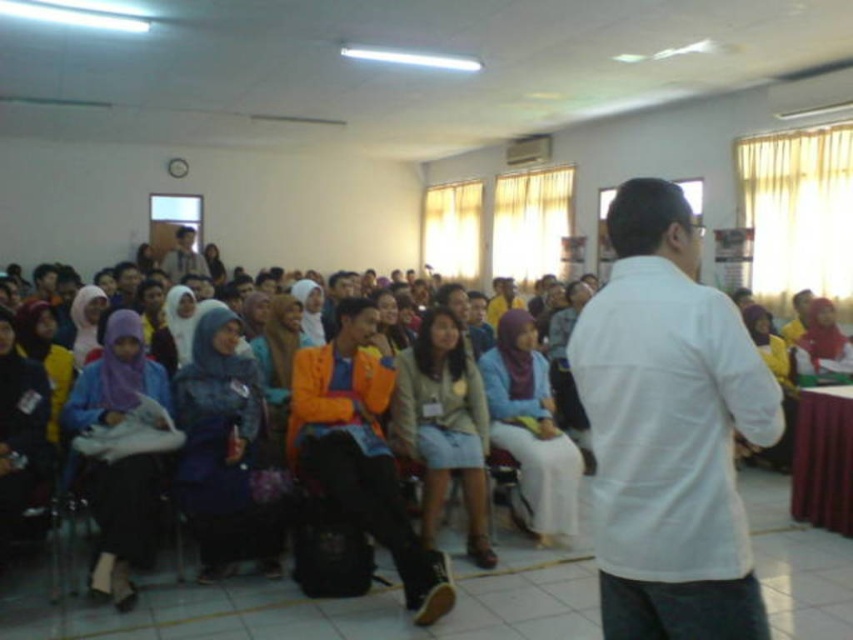
You are standing at the center of the classroom and want to move to the white matte shirt at center. Which direction should you go?

The white matte shirt at center is located at point 0.673 on the x axis and 0.785 on the y axis, so you should move towards the bottom right direction to reach it.

You are a photographer standing in the back of the classroom. You want to take a photo of the white matte shirt at center and the orange fabric shirt at center. Considering the distance between them, will you need to adjust your camera settings to capture both clearly in the same frame?

The distance between the white matte shirt at center and the orange fabric shirt at center is 25.44 feet. Since this distance is quite large, you may need to adjust your camera settings, such as using a wider lens or adjusting the focus, to ensure both subjects are in clear focus within the frame.